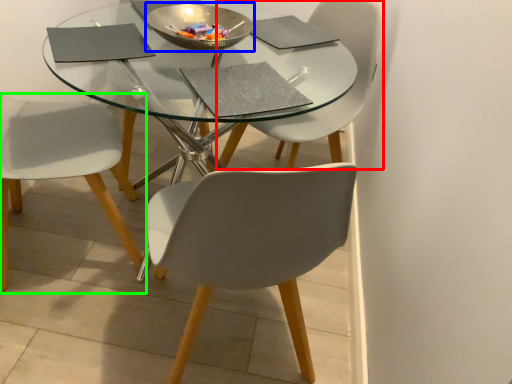
Question: Estimate the real-world distances between objects in this image. Which object is closer to chair (highlighted by a red box), bowl (highlighted by a blue box) or chair (highlighted by a green box)?

Choices:
 (A) bowl
 (B) chair

Answer: (A)